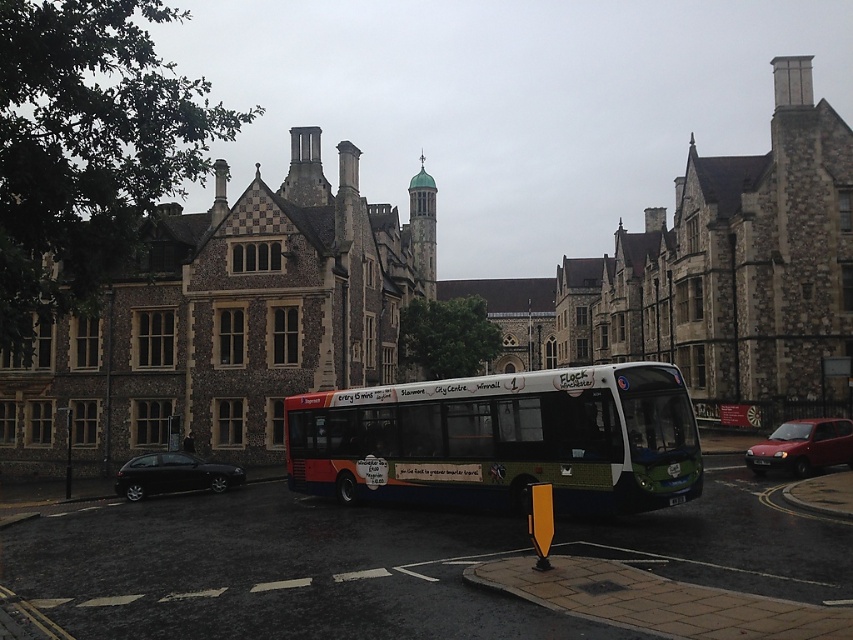
Question: Can you confirm if shiny red car at lower right is wider than shiny black hatchback at lower left?

Choices:
 (A) yes
 (B) no

Answer: (A)

Question: Which point is farther to the camera?

Choices:
 (A) tap(403, 445)
 (B) tap(128, 493)
 (C) tap(821, 420)

Answer: (B)

Question: Which point is closer to the camera?

Choices:
 (A) (799, 464)
 (B) (341, 433)

Answer: (A)

Question: Is green matte bus at center wider than shiny red car at lower right?

Choices:
 (A) no
 (B) yes

Answer: (B)

Question: Can you confirm if green matte bus at center is positioned below shiny red car at lower right?

Choices:
 (A) no
 (B) yes

Answer: (A)

Question: Which of the following is the farthest from the observer?

Choices:
 (A) (357, 392)
 (B) (157, 481)

Answer: (B)